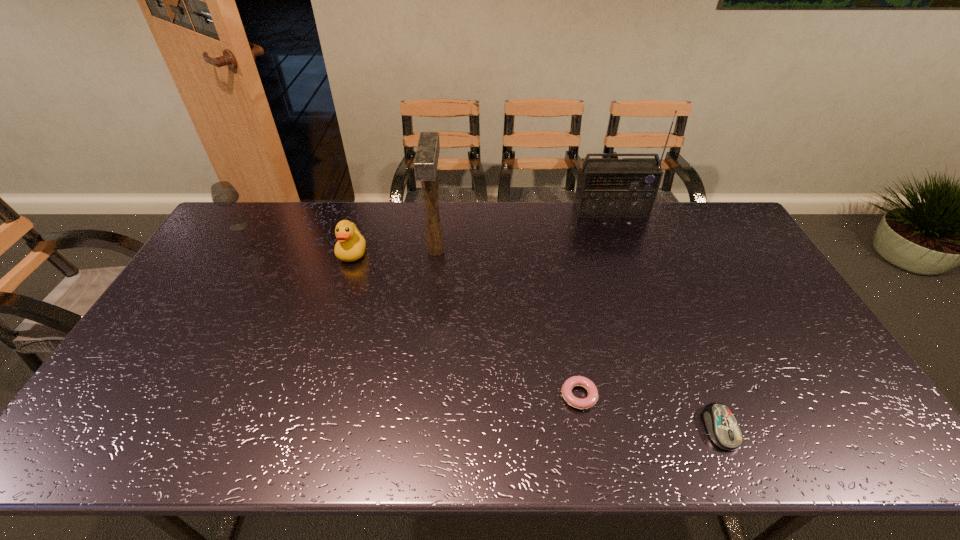
Where is `vacant area located 0.390m on the front of the mallet`? The image size is (960, 540). vacant area located 0.390m on the front of the mallet is located at coordinates (422, 371).

The width and height of the screenshot is (960, 540). What are the coordinates of `vacant space positioned 0.080m on the right of the wineglass` in the screenshot? It's located at (273, 226).

Image resolution: width=960 pixels, height=540 pixels. What are the coordinates of `free spot located at the beak of the second object from left to right` in the screenshot? It's located at (340, 292).

Where is `free space located on the right of the shortest object`? free space located on the right of the shortest object is located at coordinates (673, 395).

The width and height of the screenshot is (960, 540). In order to click on radio receiver present at the far edge in this screenshot , I will do `click(606, 187)`.

I want to click on mallet present at the far edge, so click(427, 154).

Identify the location of wineglass located in the far edge section of the desktop. (223, 194).

Where is `duck at the far edge`? This screenshot has width=960, height=540. duck at the far edge is located at coordinates (350, 246).

Find the location of a particular element. The image size is (960, 540). object that is at the near edge is located at coordinates (723, 429).

Locate an element on the screen. The height and width of the screenshot is (540, 960). object that is at the left edge is located at coordinates click(x=223, y=194).